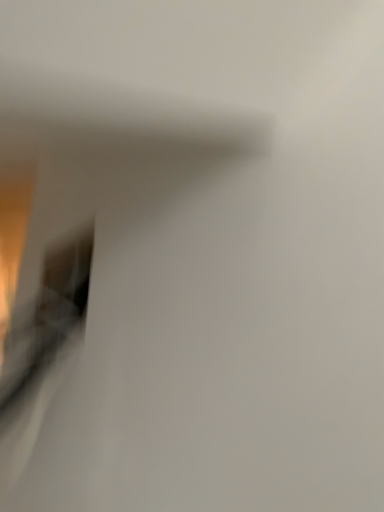
Measure the distance between matte glass window at left and camera.

A distance of 37.44 inches exists between matte glass window at left and camera.

The image size is (384, 512). What do you see at coordinates (48, 312) in the screenshot?
I see `matte glass window at left` at bounding box center [48, 312].

What are the coordinates of `matte glass window at left` in the screenshot? It's located at (48, 312).

This screenshot has height=512, width=384. Identify the location of matte glass window at left. (48, 312).